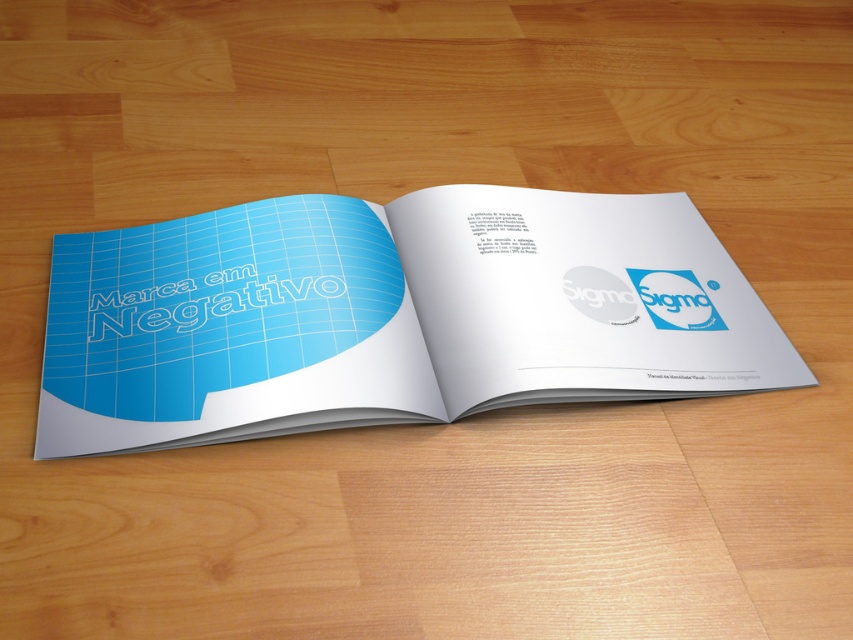
You are standing in a library and see the blue paper book at center on a table. If you walk directly towards the table, will you first encounter the book at center before reaching the edge of the table?

Result: The blue paper book at center is positioned at point (384, 316), which is near the center of the table. Since it is centrally located, you would encounter the book before reaching the edge of the table as you walk towards it.

You are standing 1.7 meters tall and want to place a 1.5 meter long ruler between the two points marked as point (61, 339) and the other point. Will the ruler fit between them?

The distance between the two points is 85.27 centimeters. Since the ruler is 150 centimeters long, it is longer than the distance between the points. Therefore, the ruler will not fit between them.